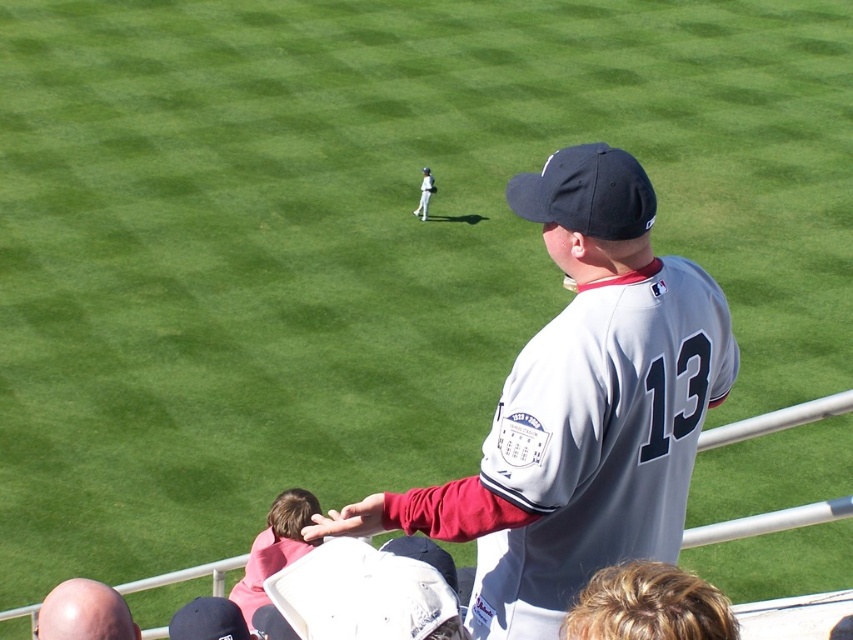
Between blonde hair at center and bald head at lower left, which one is positioned lower?

bald head at lower left is lower down.

Does blonde hair at center appear under bald head at lower left?

Incorrect, blonde hair at center is not positioned below bald head at lower left.

You are a GUI agent. You are given a task and a screenshot of the screen. Output one action in this format:
    pyautogui.click(x=<x>, y=<y>)
    Task: Click on the blonde hair at center
    The height and width of the screenshot is (640, 853).
    Given the screenshot: What is the action you would take?
    pyautogui.click(x=648, y=605)

Does gray fabric baseball jersey at center have a lesser height compared to blonde hair at center?

No.

Does gray fabric baseball jersey at center have a lesser width compared to blonde hair at center?

In fact, gray fabric baseball jersey at center might be wider than blonde hair at center.

Which is in front, point (405, 513) or point (572, 616)?

Point (572, 616) is in front.

Find the location of a particular element. The image size is (853, 640). gray fabric baseball jersey at center is located at coordinates (579, 408).

Which is below, blonde hair at center or white uniformed player at center?

blonde hair at center

Does point (675, 612) lie in front of point (425, 202)?

Yes, point (675, 612) is in front of point (425, 202).

The height and width of the screenshot is (640, 853). Describe the element at coordinates (648, 605) in the screenshot. I see `blonde hair at center` at that location.

Find the location of `blonde hair at center`. blonde hair at center is located at coordinates (648, 605).